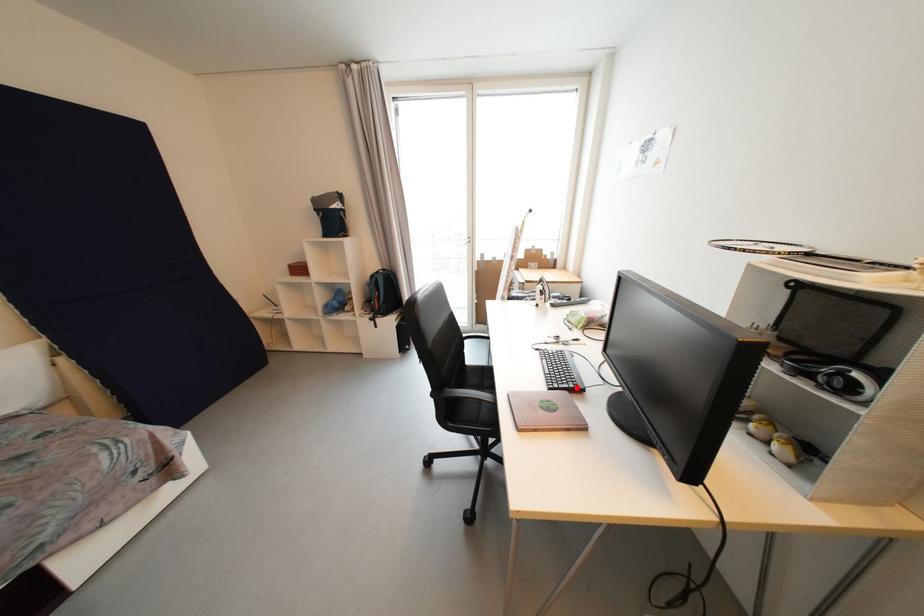
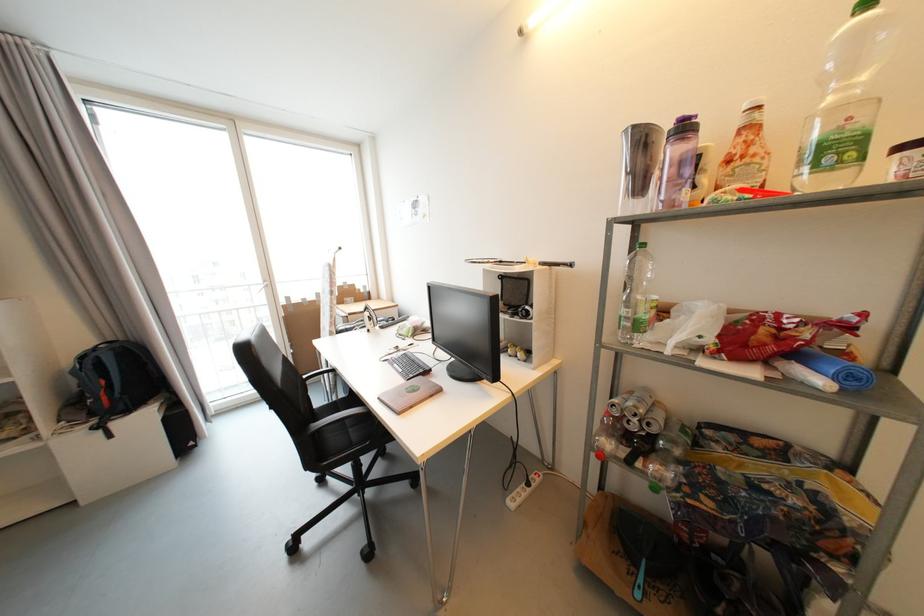
Where in the second image is the point corresponding to the highlighted location from the first image?

(427, 373)